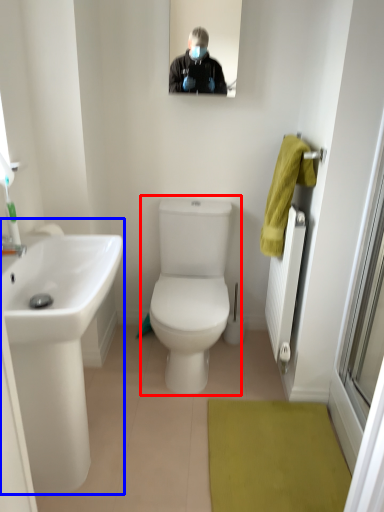
Question: Which object appears farthest to the camera in this image, toilet (highlighted by a red box) or sink (highlighted by a blue box)?

Choices:
 (A) toilet
 (B) sink

Answer: (A)